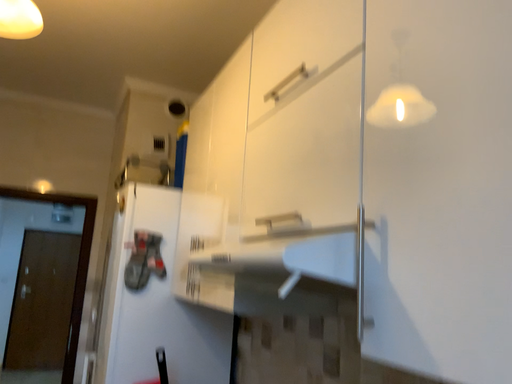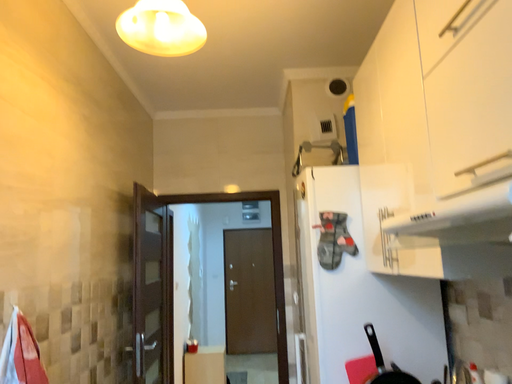
Question: How did the camera likely rotate when shooting the video?

Choices:
 (A) rotated right
 (B) rotated left

Answer: (B)